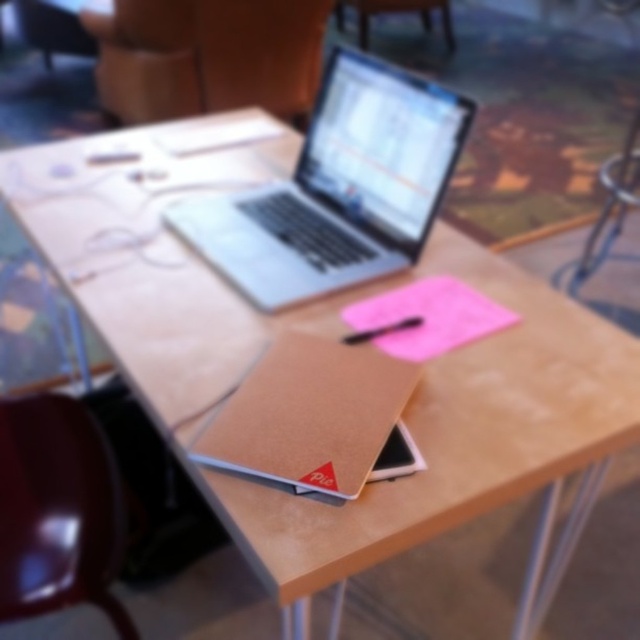
Question: Can you confirm if matte brown chair at upper center is thinner than black matte pen at center?

Choices:
 (A) yes
 (B) no

Answer: (B)

Question: Estimate the real-world distances between objects in this image. Which object is farther from the matte red chair at lower left?

Choices:
 (A) pink matte notepad at center
 (B) matte brown chair at upper center
 (C) brown kraft notepad at center

Answer: (B)

Question: Can you confirm if matte red chair at lower left is bigger than matte brown chair at upper center?

Choices:
 (A) no
 (B) yes

Answer: (A)

Question: Among these points, which one is nearest to the camera?

Choices:
 (A) (112, 608)
 (B) (342, 339)
 (C) (376, 12)
 (D) (294, 468)

Answer: (D)

Question: Can you confirm if silver metallic laptop at center is smaller than matte red chair at lower left?

Choices:
 (A) yes
 (B) no

Answer: (B)

Question: Which object is the closest to the pink matte notepad at center?

Choices:
 (A) brown kraft notepad at center
 (B) black matte pen at center

Answer: (B)